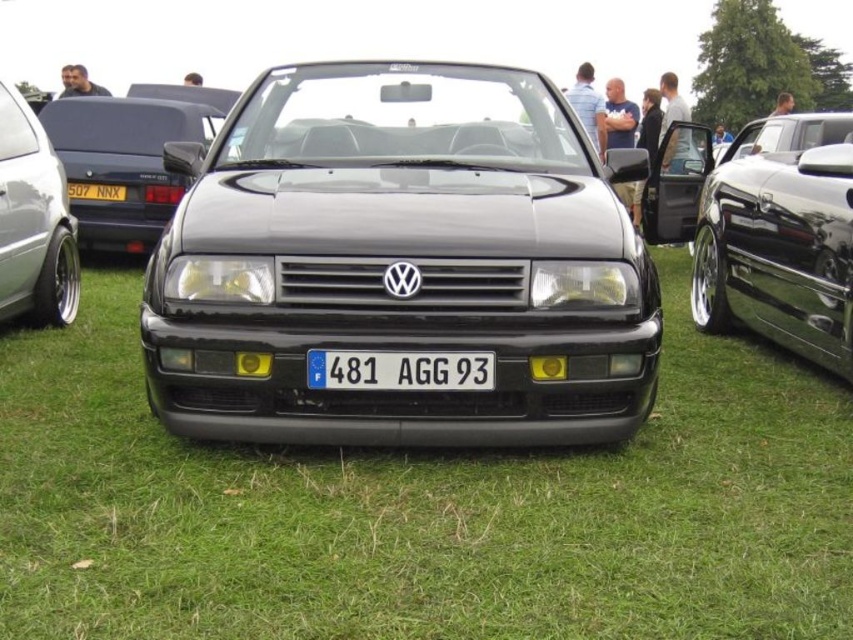
You are a photographer trying to capture both the glossy black car at center and the glossy black convertible at center in a single frame. Given that your camera can only accommodate objects up to a certain width, which vehicle should you position closer to the camera to ensure both fit in the frame without cropping?

The glossy black car at center might be wider than the glossy black convertible at center, so positioning the glossy black car at center closer to the camera would help ensure both fit within the frame since wider objects appear larger when closer.

You are standing in front of the black Volkswagen convertible at the car show. You notice two points marked on the car. The first point is at coordinate (554, 122) and the second is at (144, 179). Which of these points is closer to you?

The point at coordinate (554, 122) is closer to you than the point at (144, 179).

You are standing at the center of the grassy field where the glossy black car at center is parked. If you walk straight ahead, will you walk towards the car or away from it?

Since the glossy black car at center is located at point (x=399, y=262), which is near the center of the field, walking straight ahead from the center would take you towards the car.